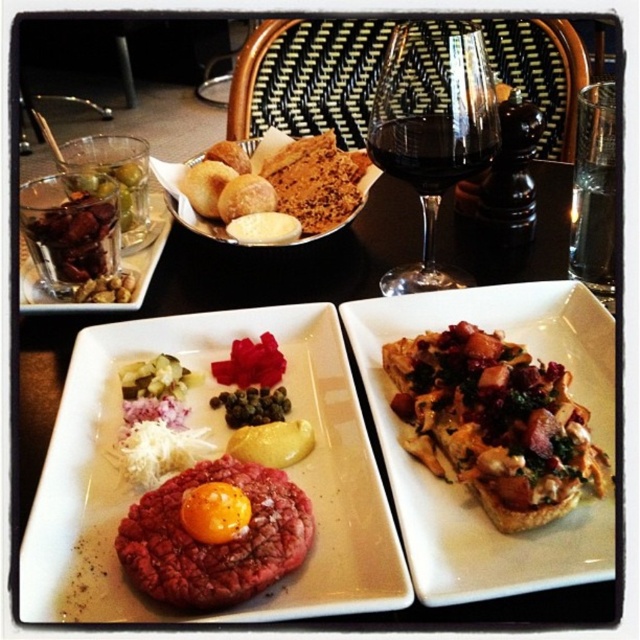
Question: Can you confirm if golden brown bread at center is smaller than translucent glass with nuts at upper left?

Choices:
 (A) yes
 (B) no

Answer: (B)

Question: Which object appears closest to the camera in this image?

Choices:
 (A) crusty bread topped with vegetables and herbs at center
 (B) raw red meat at center

Answer: (B)

Question: Which object is positioned closest to the matte glass at upper center?

Choices:
 (A) raw red beef at center
 (B) crusty bread topped with vegetables and herbs at center
 (C) raw red meat at center
 (D) golden brown bread at center

Answer: (C)

Question: Can you confirm if transparent glass at upper center is wider than translucent glass with nuts at upper left?

Choices:
 (A) no
 (B) yes

Answer: (A)

Question: Which of these objects is positioned closest to the golden brown bread at center?

Choices:
 (A) matte glass at upper center
 (B) crusty bread topped with vegetables and herbs at center
 (C) raw red meat at center
 (D) translucent glass with nuts at upper left

Answer: (D)

Question: Can you confirm if matte glass at upper center is smaller than transparent glass at upper center?

Choices:
 (A) yes
 (B) no

Answer: (B)